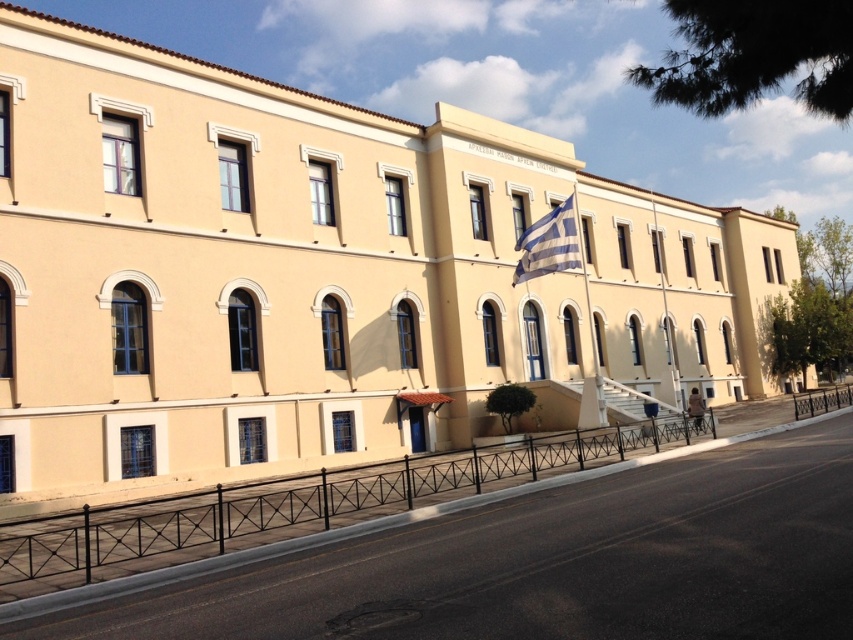
You are a tourist standing on the sidewalk in front of the building. You want to take a photo of the white fabric flag at center while avoiding the black metal fence at lower center in the shot. Which side of the flag should you move to in order to exclude the fence from the frame?

The black metal fence at lower center is on the left side of the white fabric flag at center. To exclude the fence from the photo, you should move to the right side of the flag.

You are standing on the sidewalk in front of the building and want to walk to the flagpole. Which direction should you head relative to the point at coordinates point (302,499)?

You should head towards the center of the building from the point (302,499) since the flagpole is near the center of the building and the point is on the black metal fence at lower center.

You are a tourist standing on the sidewalk in front of the building. You want to take a photo of the Greek flag on the flagpole while staying within the paved road area. Which object should you move closer to, the black metal fence at lower center or the black wrought iron railing at center?

You should move closer to the black wrought iron railing at center because the black metal fence at lower center is positioned on the left side of it, meaning the railing is closer to the road area where you need to stay.